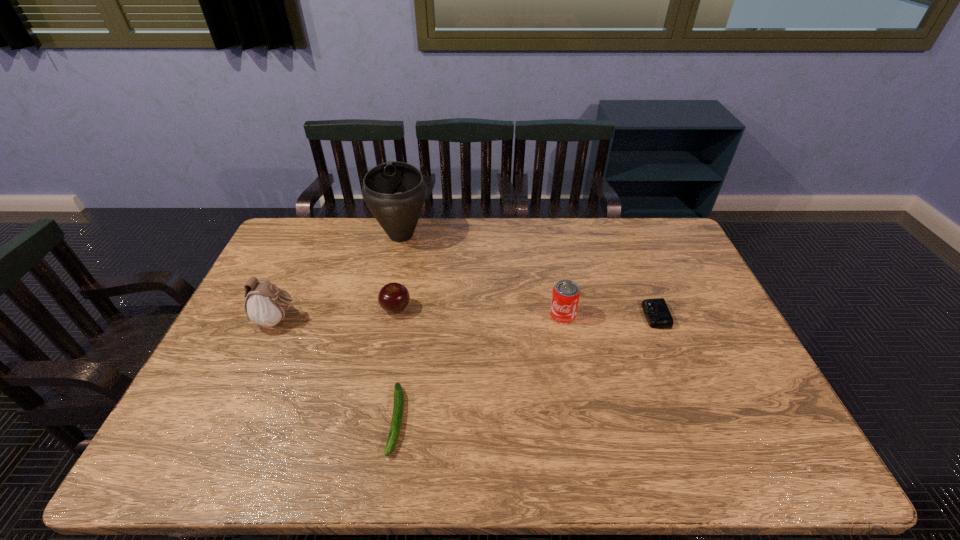
The height and width of the screenshot is (540, 960). Identify the location of urn. (395, 192).

This screenshot has height=540, width=960. Find the location of `the tallest object`. the tallest object is located at coordinates (395, 192).

Find the location of a particular element. The height and width of the screenshot is (540, 960). pouch is located at coordinates (265, 305).

Locate an element on the screen. the fifth shortest object is located at coordinates (265, 305).

You are a GUI agent. You are given a task and a screenshot of the screen. Output one action in this format:
    pyautogui.click(x=<x>, y=<y>)
    Task: Click on the second object from right to left
    The image size is (960, 540).
    Given the screenshot: What is the action you would take?
    pyautogui.click(x=565, y=297)

Where is `the fourth shortest object`? The width and height of the screenshot is (960, 540). the fourth shortest object is located at coordinates (565, 297).

At what (x,y) coordinates should I click in order to perform the action: click on the third shortest object. Please return your answer as a coordinate pair (x, y). Image resolution: width=960 pixels, height=540 pixels. Looking at the image, I should click on (394, 297).

The height and width of the screenshot is (540, 960). I want to click on alarm clock, so click(656, 311).

Locate an element on the screen. zucchini is located at coordinates (398, 408).

At what (x,y) coordinates should I click in order to perform the action: click on vacant region located on the left of the urn. Please return your answer as a coordinate pair (x, y). Looking at the image, I should click on (355, 235).